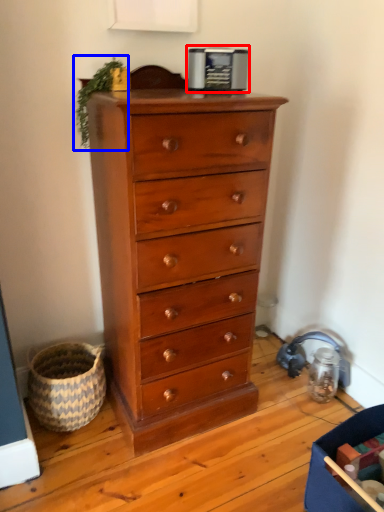
Question: Which of the following is the closest to the observer, appliance (highlighted by a red box) or plant (highlighted by a blue box)?

Choices:
 (A) appliance
 (B) plant

Answer: (B)